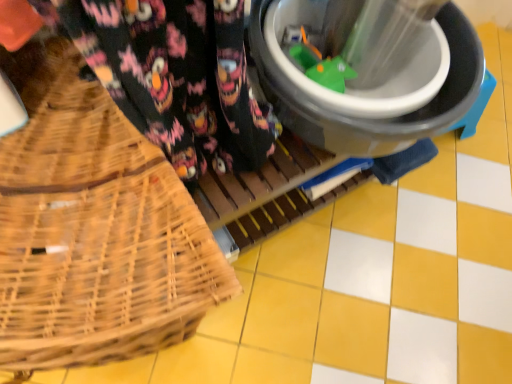
What do you see at coordinates (368, 89) in the screenshot? The width and height of the screenshot is (512, 384). I see `black plastic bucket at center` at bounding box center [368, 89].

Locate an element on the screen. black plastic bucket at center is located at coordinates (368, 89).

The image size is (512, 384). Find the location of `woven wood picnic basket at left`. woven wood picnic basket at left is located at coordinates (93, 228).

What do you see at coordinates (93, 228) in the screenshot? I see `woven wood picnic basket at left` at bounding box center [93, 228].

Where is `black plastic bucket at center`? The width and height of the screenshot is (512, 384). black plastic bucket at center is located at coordinates (368, 89).

Between black plastic bucket at center and woven wood picnic basket at left, which one appears on the right side from the viewer's perspective?

From the viewer's perspective, black plastic bucket at center appears more on the right side.

Is black plastic bucket at center in front of or behind woven wood picnic basket at left in the image?

black plastic bucket at center is behind woven wood picnic basket at left.

Is point (370, 146) in front of point (60, 65)?

No, it is not.

From the image's perspective, relative to woven wood picnic basket at left, is black plastic bucket at center above or below?

black plastic bucket at center is situated higher than woven wood picnic basket at left in the image.

From a real-world perspective, who is located higher, black plastic bucket at center or woven wood picnic basket at left?

In real-world perspective, black plastic bucket at center is above.

Considering the sizes of objects black plastic bucket at center and woven wood picnic basket at left in the image provided, who is thinner, black plastic bucket at center or woven wood picnic basket at left?

black plastic bucket at center is thinner.

Between black plastic bucket at center and woven wood picnic basket at left, which one has less height?

black plastic bucket at center is shorter.

Can you confirm if black plastic bucket at center is bigger than woven wood picnic basket at left?

No, black plastic bucket at center is not bigger than woven wood picnic basket at left.

Is black plastic bucket at center positioned beyond the bounds of woven wood picnic basket at left?

Yes, black plastic bucket at center is located beyond the bounds of woven wood picnic basket at left.

Is black plastic bucket at center directly adjacent to woven wood picnic basket at left?

There is a gap between black plastic bucket at center and woven wood picnic basket at left.

Is black plastic bucket at center aimed at woven wood picnic basket at left?

No, black plastic bucket at center does not turn towards woven wood picnic basket at left.

How many degrees apart are the facing directions of black plastic bucket at center and woven wood picnic basket at left?

1.52 degrees.

This screenshot has width=512, height=384. What are the coordinates of `picnic basket that is under the black plastic bucket at center (from a real-world perspective)` in the screenshot? It's located at (93, 228).

In the scene shown: Is woven wood picnic basket at left to the right of black plastic bucket at center from the viewer's perspective?

No, woven wood picnic basket at left is not to the right of black plastic bucket at center.

Is woven wood picnic basket at left in front of or behind black plastic bucket at center in the image?

Visually, woven wood picnic basket at left is located in front of black plastic bucket at center.

Is point (50, 155) positioned behind point (284, 112)?

No, (50, 155) is in front of (284, 112).

Consider the image. From the image's perspective, which one is positioned higher, woven wood picnic basket at left or black plastic bucket at center?

black plastic bucket at center appears higher in the image.

From a real-world perspective, between woven wood picnic basket at left and black plastic bucket at center, who is vertically lower?

In real-world perspective, woven wood picnic basket at left is lower.

Which of these two, woven wood picnic basket at left or black plastic bucket at center, is thinner?

black plastic bucket at center.

Considering the relative sizes of woven wood picnic basket at left and black plastic bucket at center in the image provided, is woven wood picnic basket at left taller than black plastic bucket at center?

Correct, woven wood picnic basket at left is much taller as black plastic bucket at center.

Does woven wood picnic basket at left have a smaller size compared to black plastic bucket at center?

No, woven wood picnic basket at left is not smaller than black plastic bucket at center.

Would you say woven wood picnic basket at left contains black plastic bucket at center?

No, black plastic bucket at center is located outside of woven wood picnic basket at left.

Is woven wood picnic basket at left positioned far away from black plastic bucket at center?

woven wood picnic basket at left is near black plastic bucket at center, not far away.

Is black plastic bucket at center at the back of woven wood picnic basket at left?

That's not correct — woven wood picnic basket at left is not looking away from black plastic bucket at center.

What's the angular difference between woven wood picnic basket at left and black plastic bucket at center's facing directions?

There is a 1.52-degree angle between the facing directions of woven wood picnic basket at left and black plastic bucket at center.

Find the location of `picnic basket in front of the black plastic bucket at center`. picnic basket in front of the black plastic bucket at center is located at coordinates (93, 228).

Find the location of a particular element. The width and height of the screenshot is (512, 384). picnic basket in front of the black plastic bucket at center is located at coordinates (93, 228).

Where is `appliance that appears above the woven wood picnic basket at left (from a real-world perspective)`? This screenshot has height=384, width=512. appliance that appears above the woven wood picnic basket at left (from a real-world perspective) is located at coordinates (368, 89).